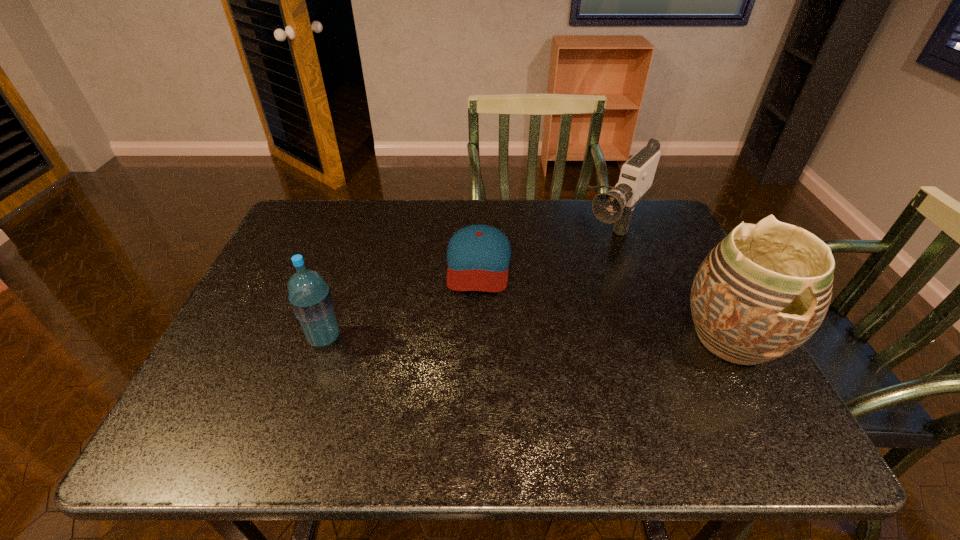
Image resolution: width=960 pixels, height=540 pixels. Identify the location of vacant point located 0.260m with the bill of the baseball cap facing forward. (470, 382).

I want to click on free space located with the bill of the baseball cap facing forward, so click(469, 394).

Where is `free location located with the bill of the baseball cap facing forward`? free location located with the bill of the baseball cap facing forward is located at coordinates (470, 382).

Image resolution: width=960 pixels, height=540 pixels. Identify the location of camcorder located at the far edge. (616, 206).

I want to click on baseball cap at the far edge, so click(478, 256).

This screenshot has width=960, height=540. I want to click on object present at the near edge, so click(x=764, y=290).

Locate an element on the screen. The height and width of the screenshot is (540, 960). pottery that is positioned at the right edge is located at coordinates (764, 290).

The image size is (960, 540). I want to click on camcorder positioned at the right edge, so click(x=616, y=206).

Locate an element on the screen. This screenshot has width=960, height=540. object present at the far right corner is located at coordinates (616, 206).

The width and height of the screenshot is (960, 540). I want to click on object present at the near right corner, so (764, 290).